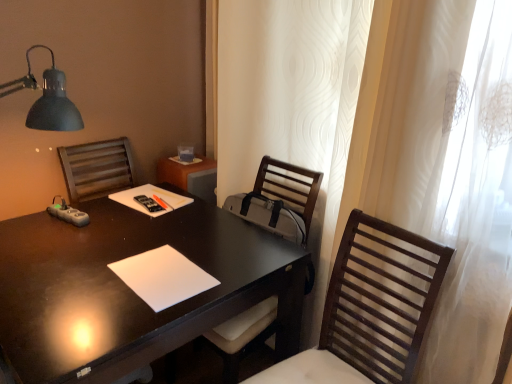
The image size is (512, 384). I want to click on vacant space to the left of black plastic remote control at center, so click(113, 203).